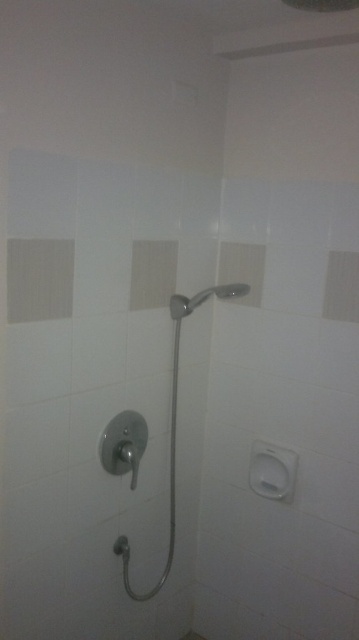
Does silver metallic shower head at center have a lesser width compared to satin nickel shower handle at center?

In fact, silver metallic shower head at center might be wider than satin nickel shower handle at center.

Does point (170, 449) come farther from viewer compared to point (218, 296)?

No, (170, 449) is in front of (218, 296).

Where is `silver metallic shower head at center`? Image resolution: width=359 pixels, height=640 pixels. silver metallic shower head at center is located at coordinates (174, 426).